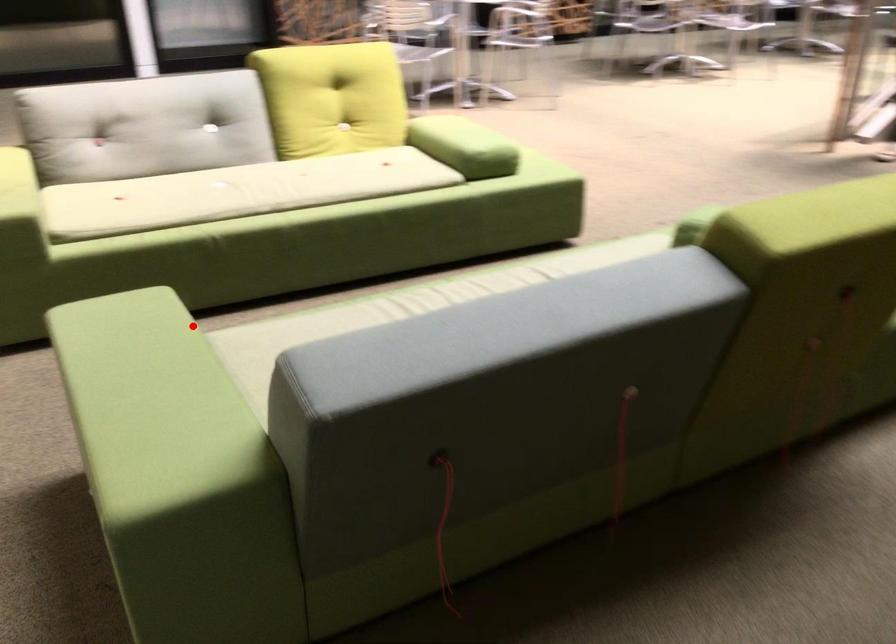
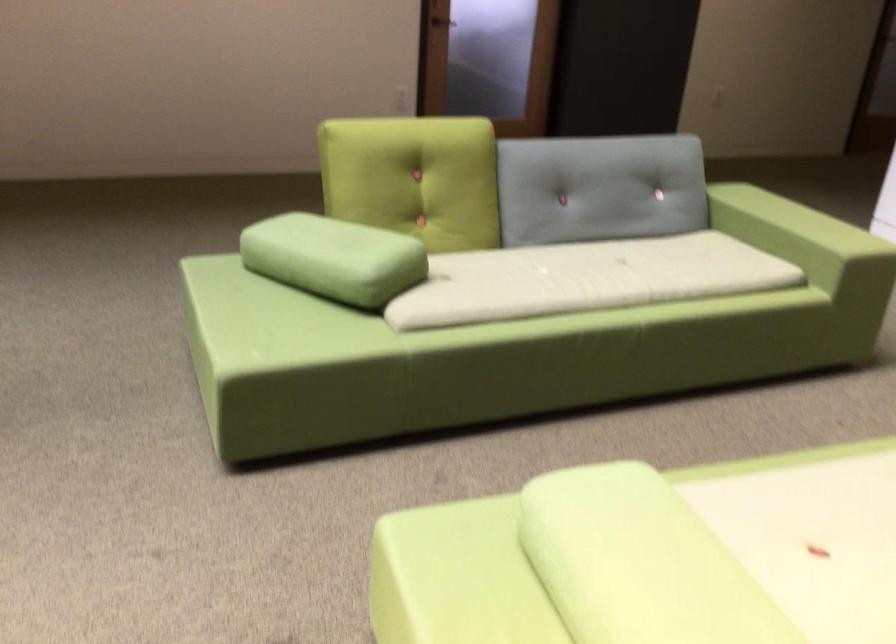
Question: A red point is marked in image1. In image2, is the corresponding 3D point closer to the camera or farther? Reply with the corresponding letter.

Choices:
 (A) The corresponding 3D point is closer.
 (B) The corresponding 3D point is farther.

Answer: (B)